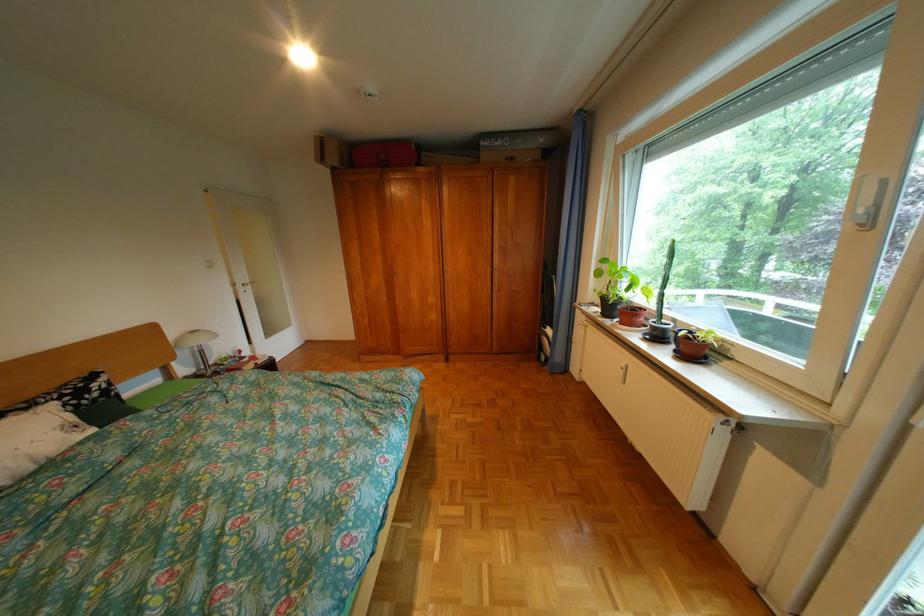
Find where to turn the white door handle. Please return your answer as a coordinate pair (x, y).

(239, 286)